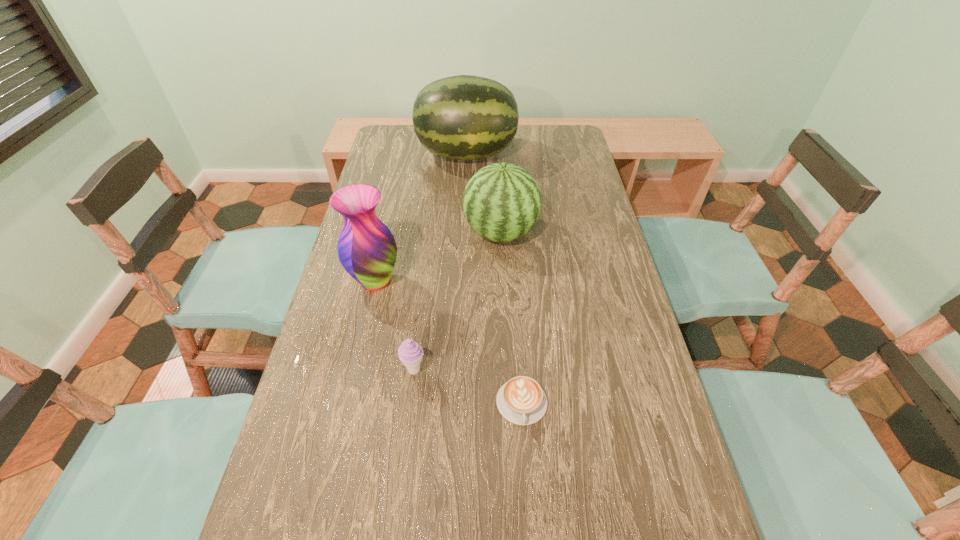
This screenshot has height=540, width=960. Identify the location of empty space that is in between the fourth nearest object and the shortest object. (511, 318).

You are a GUI agent. You are given a task and a screenshot of the screen. Output one action in this format:
    pyautogui.click(x=<x>, y=<y>)
    Task: Click on the vacant area that lies between the icecream and the second farthest object
    
    Given the screenshot: What is the action you would take?
    pyautogui.click(x=457, y=302)

Locate an element on the screen. Image resolution: width=960 pixels, height=540 pixels. free space between the farthest object and the vase is located at coordinates (420, 218).

At what (x,y) coordinates should I click in order to perform the action: click on vacant space that's between the shortest object and the nearer watermelon. Please return your answer as a coordinate pair (x, y). The image size is (960, 540). Looking at the image, I should click on (511, 318).

What are the coordinates of `free point between the fourth nearest object and the vase` in the screenshot? It's located at (438, 257).

The width and height of the screenshot is (960, 540). Find the location of `empty space between the farther watermelon and the shortest object`. empty space between the farther watermelon and the shortest object is located at coordinates (494, 279).

Find the location of a particular element. The width and height of the screenshot is (960, 540). vacant area between the second shortest object and the vase is located at coordinates pyautogui.click(x=395, y=326).

Locate an element on the screen. The image size is (960, 540). empty space between the farther watermelon and the shortest object is located at coordinates (494, 279).

At what (x,y) coordinates should I click in order to perform the action: click on object that can be found as the fourth closest to the icecream. Please return your answer as a coordinate pair (x, y). The width and height of the screenshot is (960, 540). Looking at the image, I should click on [464, 117].

Identify which object is the second nearest to the third farthest object. Please provide its 2D coordinates. Your answer should be formatted as a tuple, i.e. [(x, y)], where the tuple contains the x and y coordinates of a point satisfying the conditions above.

[(410, 353)]